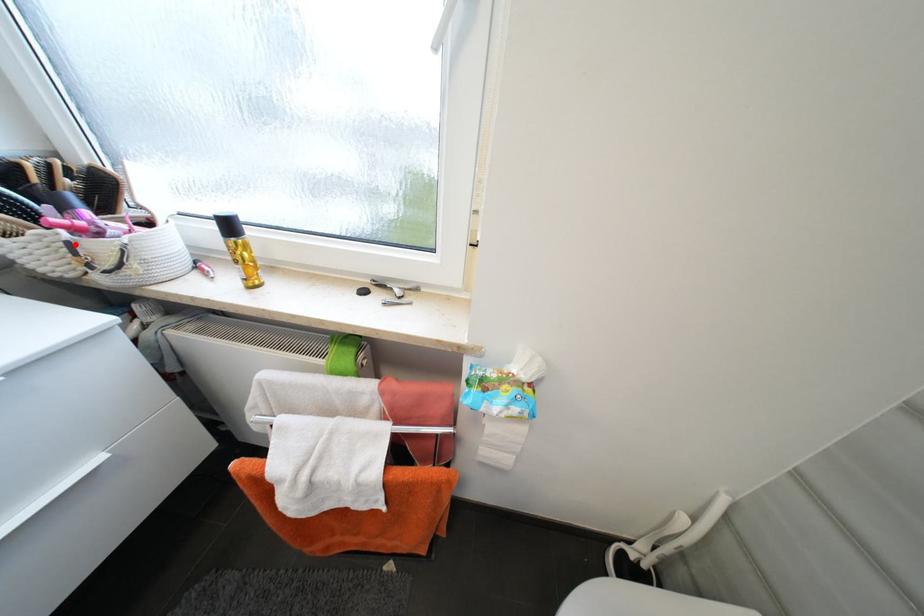
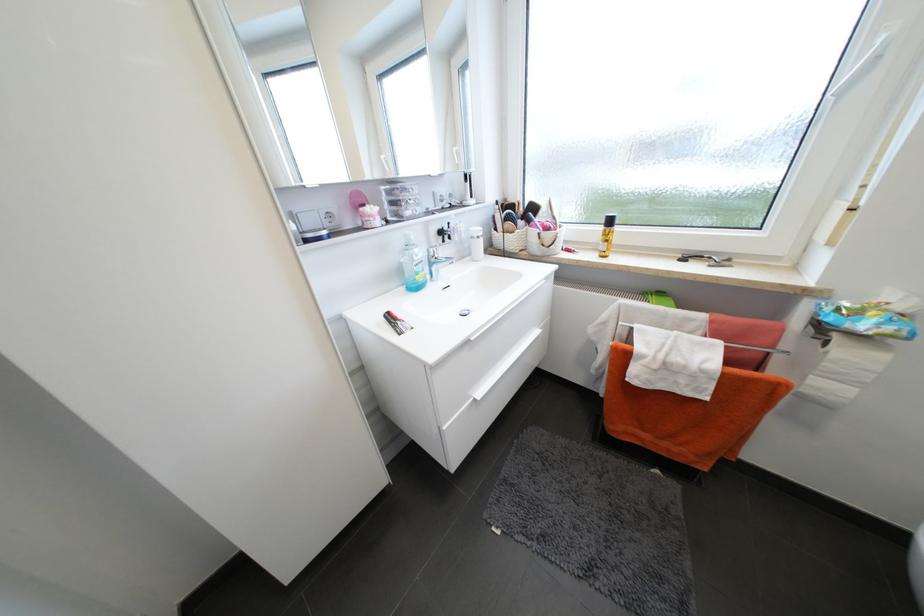
Question: I am providing you with two images of the same scene from different viewpoints. A red point is marked on the first image. Is the red point's position out of view in image 2?

Choices:
 (A) Yes
 (B) No

Answer: (B)